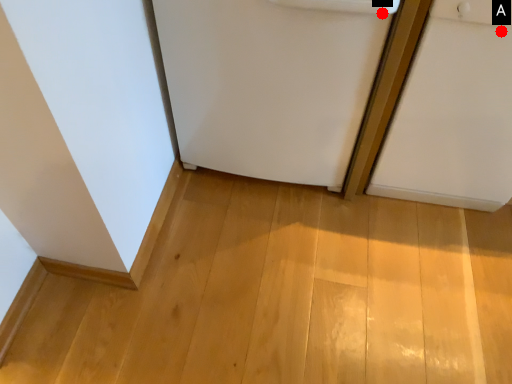
Question: Two points are circled on the image, labeled by A and B beside each circle. Among these points, which one is nearest to the camera?

Choices:
 (A) A is closer
 (B) B is closer

Answer: (A)